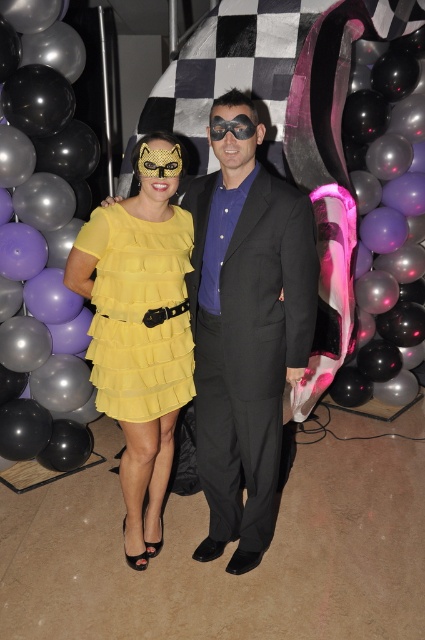
Question: Does yellow fabric dress at center appear under black glossy balloon at left?

Choices:
 (A) yes
 (B) no

Answer: (A)

Question: Which of the following is the farthest from the observer?

Choices:
 (A) yellow fabric dress at center
 (B) yellow chiffon dress at center

Answer: (B)

Question: Can you confirm if black glossy balloon at left is positioned to the right of yellow chiffon dress at center?

Choices:
 (A) no
 (B) yes

Answer: (A)

Question: Which point is farther from the camera taking this photo?

Choices:
 (A) (152, 314)
 (B) (212, 336)
 (C) (31, 202)
 (D) (112, 333)

Answer: (C)

Question: Can you confirm if yellow fabric dress at center is positioned to the right of yellow tulle dress at center?

Choices:
 (A) no
 (B) yes

Answer: (B)

Question: Which point is farther to the camera?

Choices:
 (A) yellow tulle dress at center
 (B) yellow fabric dress at center

Answer: (A)